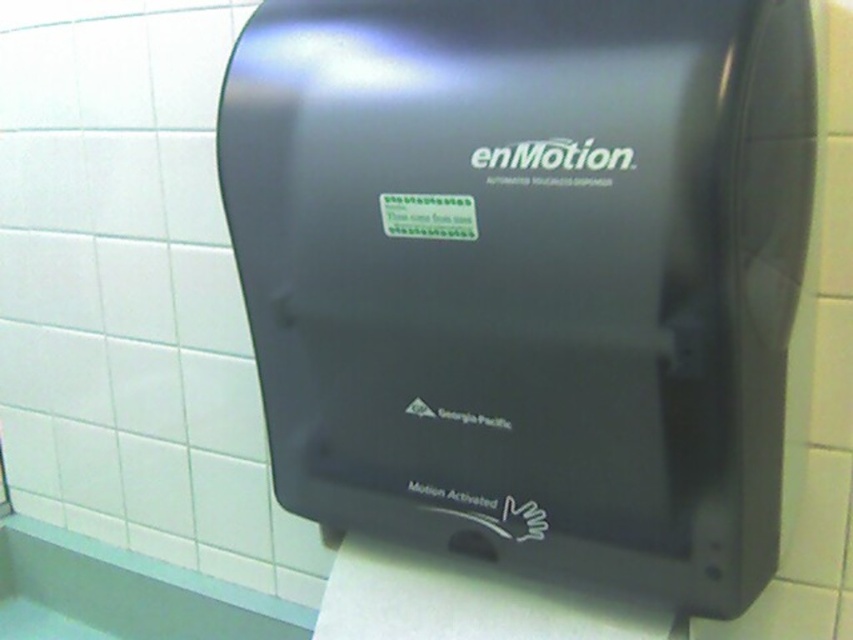
You are in a restroom and need to dry your hands. You see a black plastic hand dryer at center and a white matte toilet paper at lower center. Which one is taller?

The black plastic hand dryer at center is taller than the white matte toilet paper at lower center.

You are a maintenance worker who needs to clean the black plastic hand dryer at center and the white matte toilet paper at lower center. If your cleaning spray bottle has a reach of 6 inches, can you clean both without moving the bottle? Please explain based on their distance.

The black plastic hand dryer at center and white matte toilet paper at lower center are 7.22 inches apart. Since the spray bottle only reaches 6 inches, you cannot clean both without moving the bottle because the distance between them exceeds the spray range.